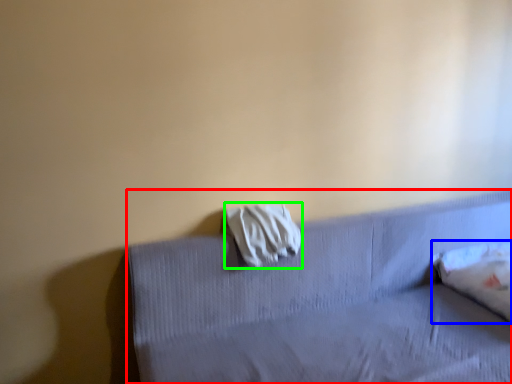
Question: Which object is the farthest from furniture (highlighted by a red box)? Choose among these: pillow (highlighted by a blue box) or material (highlighted by a green box).

Choices:
 (A) pillow
 (B) material

Answer: (A)